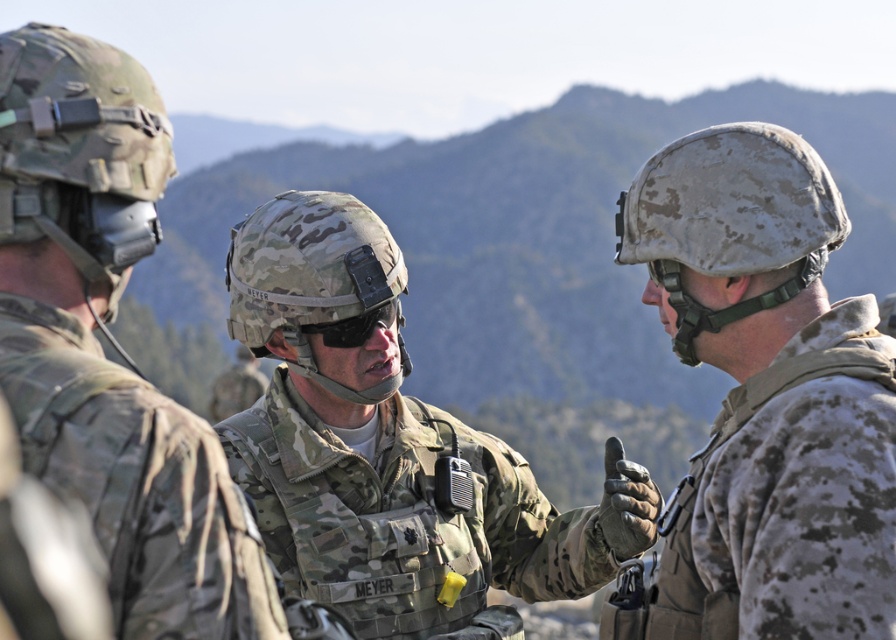
You are a drone operator observing the military scene. You need to determine which point is closer to your drone camera. Which point is closer to the camera between point (673,544) and point (52,80)?

Point (52,80) is closer to the camera because it is less further to the viewer than point (673,544).

You are standing at the point where the three soldiers are located. You want to know how far you are from the point at coordinates point (339, 198). Can you determine the distance?

The distance of point (339, 198) from viewer is 22.80 feet, so you are 22.80 feet away from the point (339, 198).